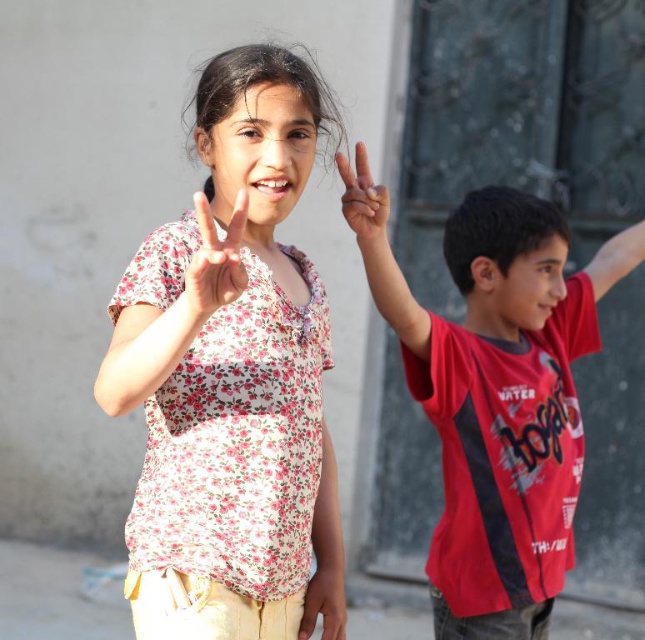
Question: Which point is farther from the camera taking this photo?

Choices:
 (A) (308, 630)
 (B) (504, 216)
 (C) (197, 192)

Answer: (C)

Question: Considering the relative positions of red matte shirt at right and matte floral shirt at center in the image provided, where is red matte shirt at right located with respect to matte floral shirt at center?

Choices:
 (A) right
 (B) left

Answer: (A)

Question: Based on their relative distances, which object is nearer to the matte floral shirt at center?

Choices:
 (A) floral fabric shirt at center
 (B) floral fabric hand at center
 (C) red matte shirt at right

Answer: (A)

Question: In this image, where is floral fabric hand at center located relative to matte floral shirt at center?

Choices:
 (A) below
 (B) above

Answer: (B)

Question: Which object is farther from the camera taking this photo?

Choices:
 (A) red matte shirt at right
 (B) matte pink hand at center
 (C) matte floral shirt at center

Answer: (A)

Question: Can you confirm if matte pink hand at center is positioned to the left of matte floral shirt at center?

Choices:
 (A) no
 (B) yes

Answer: (A)